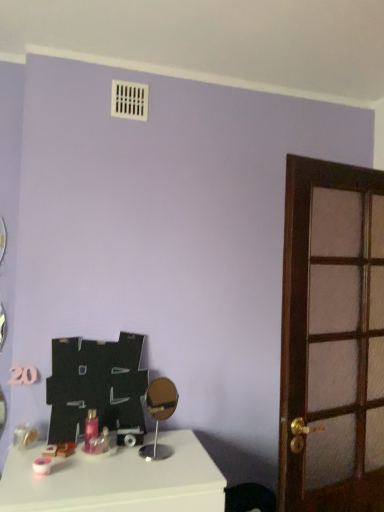
Question: From their relative heights in the image, would you say brown wooden door at right is taller or shorter than gold metallic mirror at center?

Choices:
 (A) tall
 (B) short

Answer: (A)

Question: From the image's perspective, is brown wooden door at right located above or below gold metallic mirror at center?

Choices:
 (A) below
 (B) above

Answer: (B)

Question: Considering the real-world distances, which object is closest to the gold metallic mirror at center?

Choices:
 (A) pink glossy bottle at center
 (B) white glossy table at lower left
 (C) brown wooden door at right

Answer: (B)

Question: Which of these objects is positioned closest to the brown wooden door at right?

Choices:
 (A) white glossy table at lower left
 (B) gold metallic mirror at center
 (C) pink glossy bottle at center

Answer: (A)